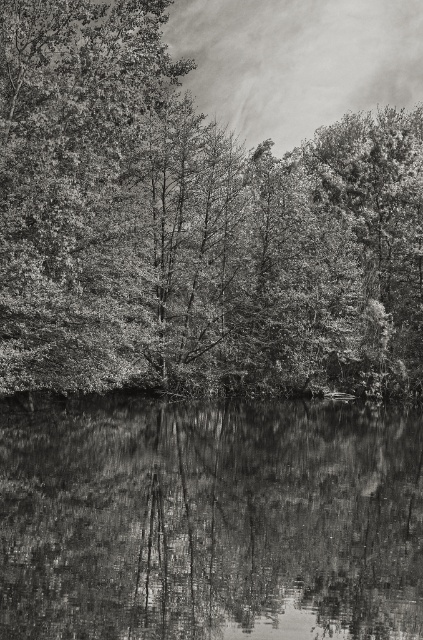
Is smooth bark tree at upper center smaller than smooth reflective water at bottom?

Actually, smooth bark tree at upper center might be larger than smooth reflective water at bottom.

Looking at this image, is smooth bark tree at upper center to the left of smooth reflective water at bottom from the viewer's perspective?

No, smooth bark tree at upper center is not to the left of smooth reflective water at bottom.

Measure the distance between smooth bark tree at upper center and camera.

smooth bark tree at upper center is 31.80 meters from camera.

Identify the location of smooth bark tree at upper center. The height and width of the screenshot is (640, 423). click(192, 225).